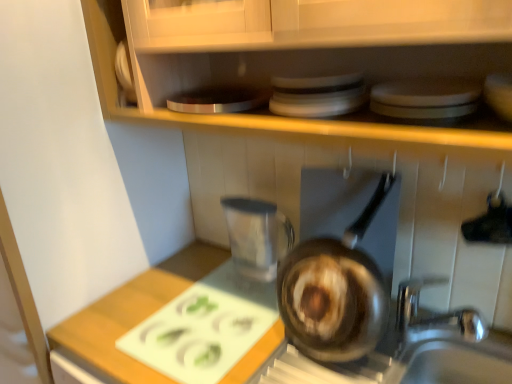
Question: Considering the relative sizes of shiny brown frying pan at center and white glossy plates at upper center in the image provided, is shiny brown frying pan at center taller than white glossy plates at upper center?

Choices:
 (A) yes
 (B) no

Answer: (A)

Question: Is shiny brown frying pan at center not near white glossy plates at upper center?

Choices:
 (A) no
 (B) yes

Answer: (A)

Question: Is shiny brown frying pan at center wider than white glossy plates at upper center?

Choices:
 (A) yes
 (B) no

Answer: (B)

Question: Is shiny brown frying pan at center looking in the opposite direction of white glossy plates at upper center?

Choices:
 (A) no
 (B) yes

Answer: (A)

Question: From a real-world perspective, is shiny brown frying pan at center located beneath white glossy plates at upper center?

Choices:
 (A) no
 (B) yes

Answer: (B)

Question: Is shiny brown frying pan at center facing towards white glossy plates at upper center?

Choices:
 (A) no
 (B) yes

Answer: (A)

Question: Can you confirm if white cutting board at center is wider than white glossy plates at upper center?

Choices:
 (A) no
 (B) yes

Answer: (B)

Question: Is white cutting board at center positioned beyond the bounds of white glossy plates at upper center?

Choices:
 (A) yes
 (B) no

Answer: (A)

Question: Would you say white cutting board at center contains white glossy plates at upper center?

Choices:
 (A) yes
 (B) no

Answer: (B)

Question: Considering the relative sizes of white cutting board at center and white glossy plates at upper center in the image provided, is white cutting board at center taller than white glossy plates at upper center?

Choices:
 (A) yes
 (B) no

Answer: (B)

Question: From the image's perspective, is white cutting board at center on white glossy plates at upper center?

Choices:
 (A) no
 (B) yes

Answer: (A)

Question: From the image's perspective, is white cutting board at center beneath white glossy plates at upper center?

Choices:
 (A) yes
 (B) no

Answer: (A)

Question: Can you confirm if shiny brown frying pan at center is shorter than white cutting board at center?

Choices:
 (A) yes
 (B) no

Answer: (B)